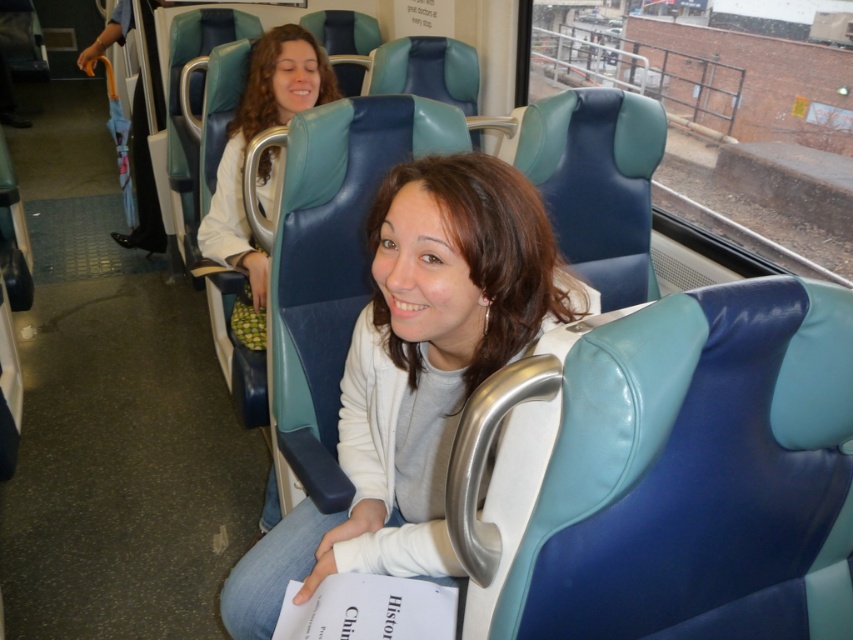
You are standing at the entrance of the train carriage and see the point marked at coordinates (416, 372). What object is located at that point?

The point at coordinates (416, 372) marks the matte blue jacket at center.

You are a passenger on a train and see the matte blue jacket at center and the matte white shirt at upper center. Which one is positioned lower in the image?

The matte blue jacket at center is positioned lower than the matte white shirt at upper center in the image.